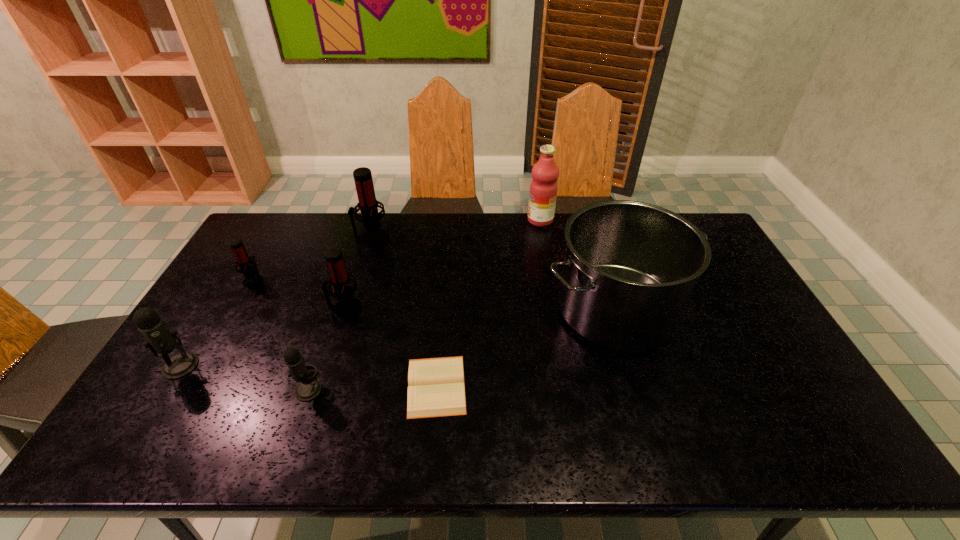
This screenshot has width=960, height=540. I want to click on fruit juice, so click(x=543, y=189).

This screenshot has width=960, height=540. Identify the location of pink fruit juice. (543, 189).

Image resolution: width=960 pixels, height=540 pixels. Identify the location of the farthest microphone. (374, 236).

Find the location of a particular element. the seventh nearest object is located at coordinates (374, 236).

The image size is (960, 540). I want to click on saucepan, so click(630, 267).

Identify the location of the third farthest microphone. The width and height of the screenshot is (960, 540). (347, 306).

Locate an element on the screen. This screenshot has width=960, height=540. the second smallest red microphone is located at coordinates (347, 306).

I want to click on the bigger black microphone, so click(x=159, y=339).

I want to click on the fourth nearest microphone, so click(248, 268).

At what (x,y) coordinates should I click in order to perform the action: click on the leftmost red microphone. Please return your answer as a coordinate pair (x, y). Image resolution: width=960 pixels, height=540 pixels. Looking at the image, I should click on (248, 268).